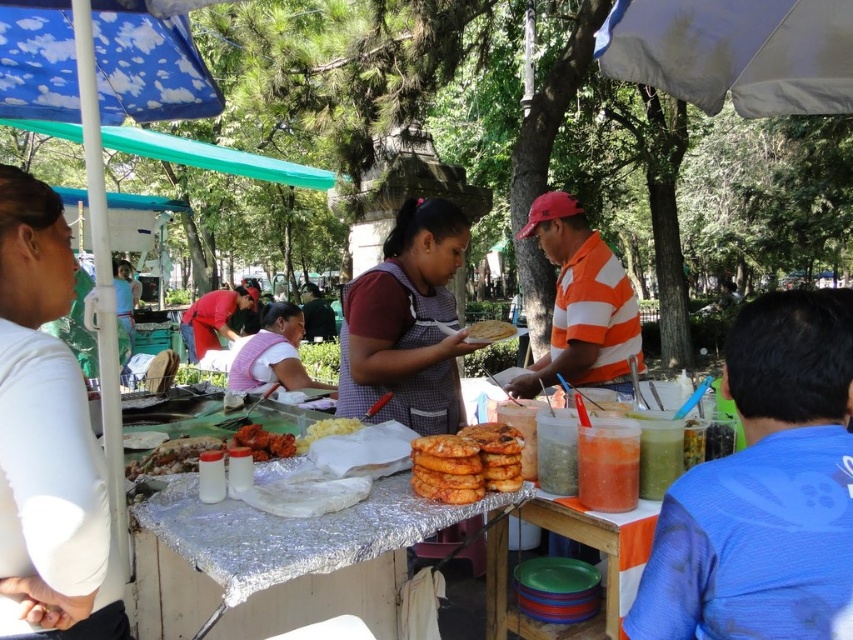
Does translucent orange juice at lower right have a lesser width compared to white matte corn at center?

Indeed, translucent orange juice at lower right has a lesser width compared to white matte corn at center.

Can you confirm if translucent orange juice at lower right is wider than white matte corn at center?

Incorrect, translucent orange juice at lower right's width does not surpass white matte corn at center's.

At what (x,y) coordinates should I click in order to perform the action: click on translucent orange juice at lower right. Please return your answer as a coordinate pair (x, y). The height and width of the screenshot is (640, 853). Looking at the image, I should click on (608, 465).

Is blue fabric shirt at right positioned before silver foil table at center?

That is True.

Can you confirm if blue fabric shirt at right is wider than silver foil table at center?

Incorrect, blue fabric shirt at right's width does not surpass silver foil table at center's.

This screenshot has height=640, width=853. Find the location of `blue fabric shirt at right`. blue fabric shirt at right is located at coordinates (763, 490).

Can you confirm if blue fabric shirt at right is positioned to the right of shiny plastic container at center?

Correct, you'll find blue fabric shirt at right to the right of shiny plastic container at center.

Does blue fabric shirt at right come in front of shiny plastic container at center?

Yes, it is in front of shiny plastic container at center.

Between point (776, 321) and point (169, 440), which one is positioned behind?

The point (169, 440) is more distant.

Where is `blue fabric shirt at right`? This screenshot has width=853, height=640. blue fabric shirt at right is located at coordinates (x=763, y=490).